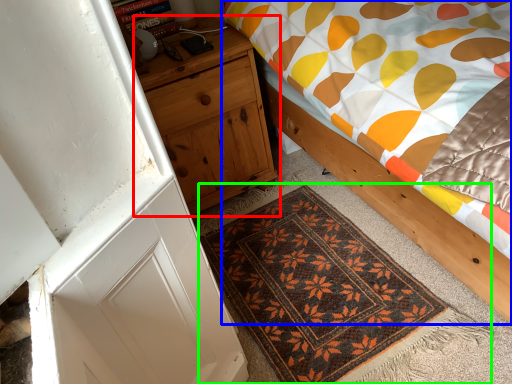
Question: Which is farther away from nightstand (highlighted by a red box)? bed (highlighted by a blue box) or mat (highlighted by a green box)?

Choices:
 (A) bed
 (B) mat

Answer: (B)